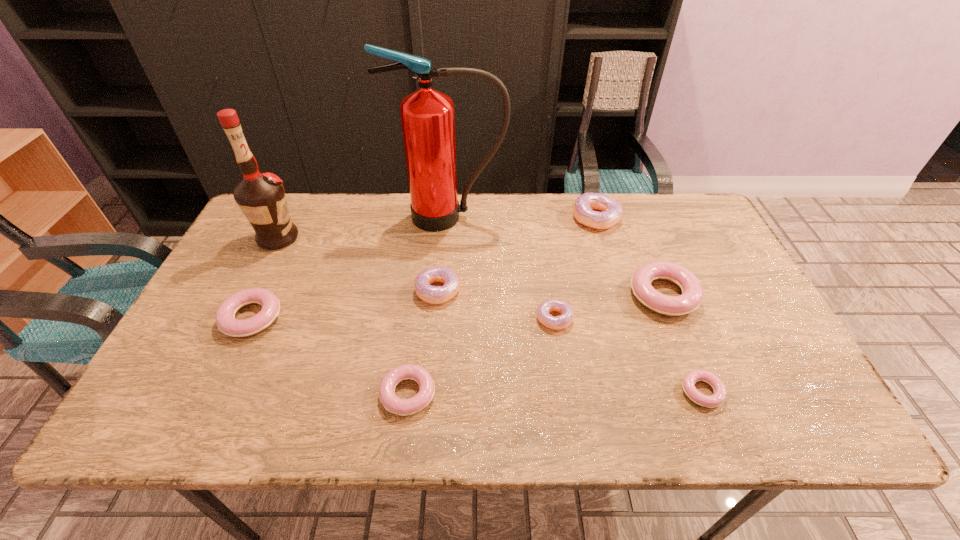
Locate an element on the screen. The width and height of the screenshot is (960, 540). vacant region between the leftmost purple doughnut and the second tallest object is located at coordinates (358, 264).

Image resolution: width=960 pixels, height=540 pixels. Find the location of `empty location between the fire extinguisher and the biggest pink doughnut`. empty location between the fire extinguisher and the biggest pink doughnut is located at coordinates (556, 256).

At what (x,y) coordinates should I click in order to perform the action: click on blank region between the smallest pink doughnut and the liquor. Please return your answer as a coordinate pair (x, y). The height and width of the screenshot is (540, 960). Looking at the image, I should click on (490, 315).

The image size is (960, 540). Find the location of `unoccupied position between the leftmost purple doughnut and the leftmost pink doughnut`. unoccupied position between the leftmost purple doughnut and the leftmost pink doughnut is located at coordinates (345, 304).

At what (x,y) coordinates should I click in order to perform the action: click on empty space between the leftmost doughnut and the shortest object. Please return your answer as a coordinate pair (x, y). The height and width of the screenshot is (540, 960). Looking at the image, I should click on (477, 355).

The height and width of the screenshot is (540, 960). What are the coordinates of `object that stands as the closest to the third biggest pink doughnut` in the screenshot? It's located at (430, 294).

Choose which object is the seventh nearest neighbor to the leftmost pink doughnut. Please provide its 2D coordinates. Your answer should be formatted as a tuple, i.e. [(x, y)], where the tuple contains the x and y coordinates of a point satisfying the conditions above.

[(692, 292)]

Point out which doughnut is positioned as the seventh nearest to the eighth shortest object. Please provide its 2D coordinates. Your answer should be formatted as a tuple, i.e. [(x, y)], where the tuple contains the x and y coordinates of a point satisfying the conditions above.

[(689, 380)]

Select which doughnut is the fifth closest to the leftmost purple doughnut. Please provide its 2D coordinates. Your answer should be formatted as a tuple, i.e. [(x, y)], where the tuple contains the x and y coordinates of a point satisfying the conditions above.

[(692, 292)]

Find the location of a particular element. The width and height of the screenshot is (960, 540). the second closest purple doughnut relative to the fourth doughnut from left to right is located at coordinates (584, 205).